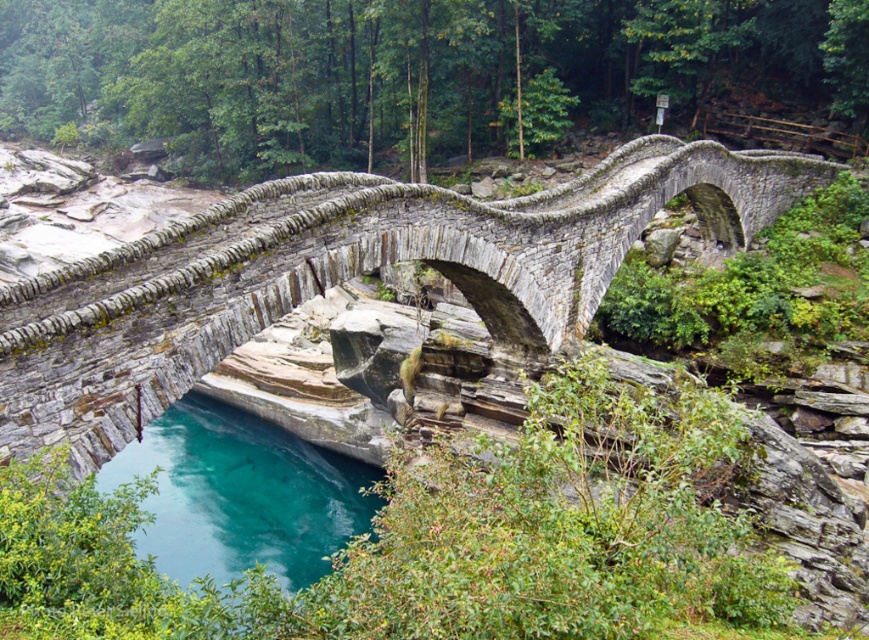
You are standing at the point marked by coordinates point (345, 275) in the image. What structure are you currently on?

The point (345, 275) marks the gray stone bridge at center, so you are currently on the gray stone bridge at center.